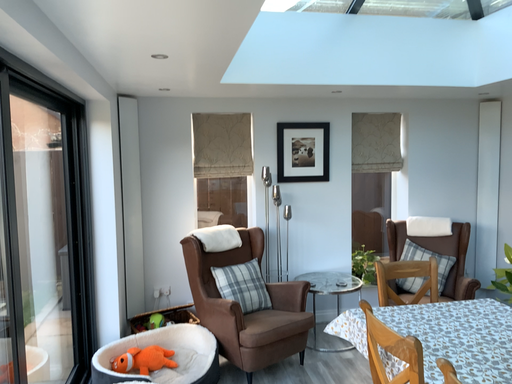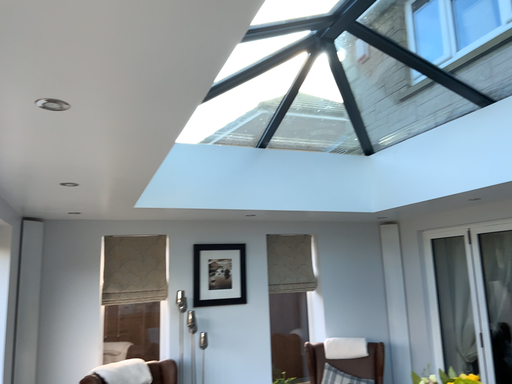
Question: Which way did the camera rotate in the video?

Choices:
 (A) rotated upward
 (B) rotated downward

Answer: (A)